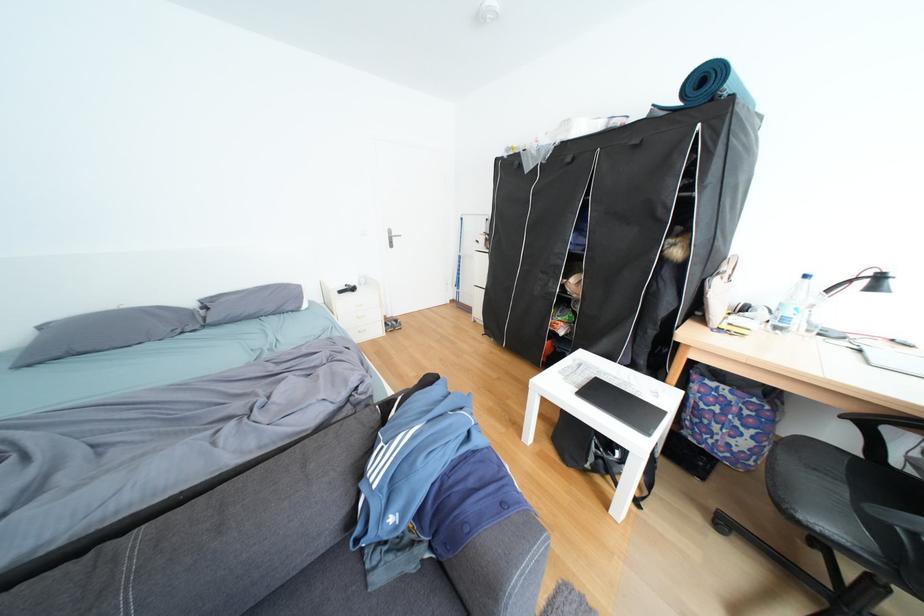
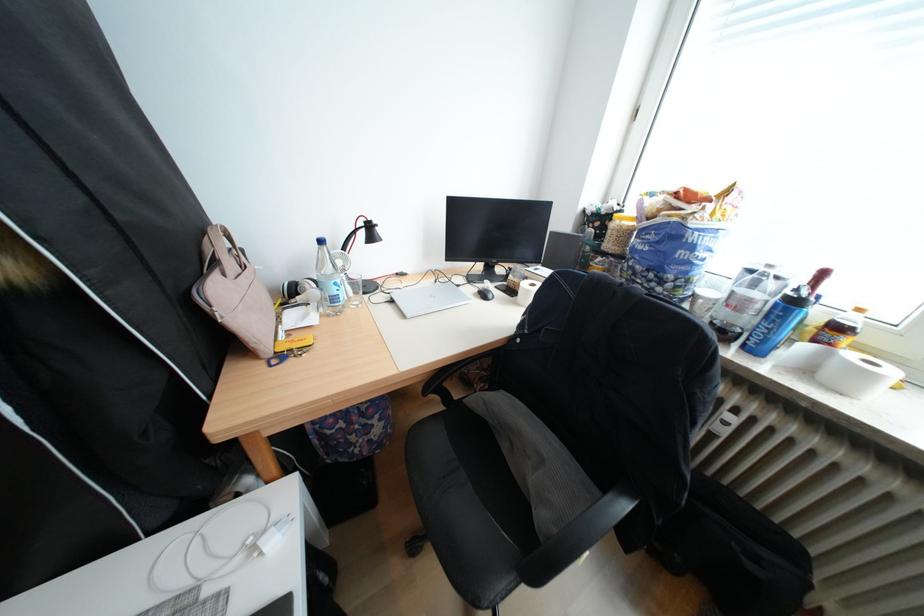
The point at (874, 284) is marked in the first image. Where is the corresponding point in the second image?

(374, 235)